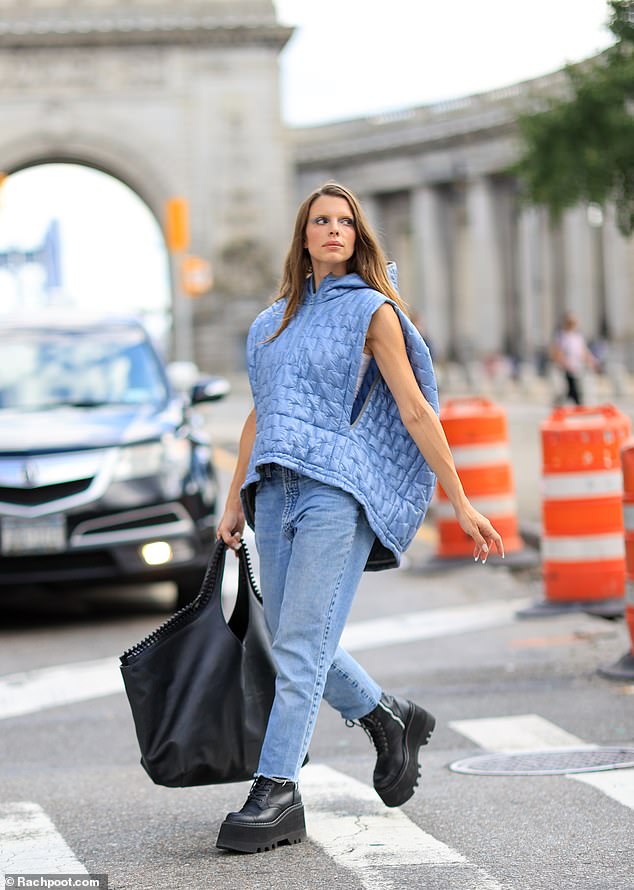
You are a GUI agent. You are given a task and a screenshot of the screen. Output one action in this format:
    pyautogui.click(x=<x>, y=<y>)
    Task: Click on the archway
    
    Given the screenshot: What is the action you would take?
    pyautogui.click(x=56, y=150)